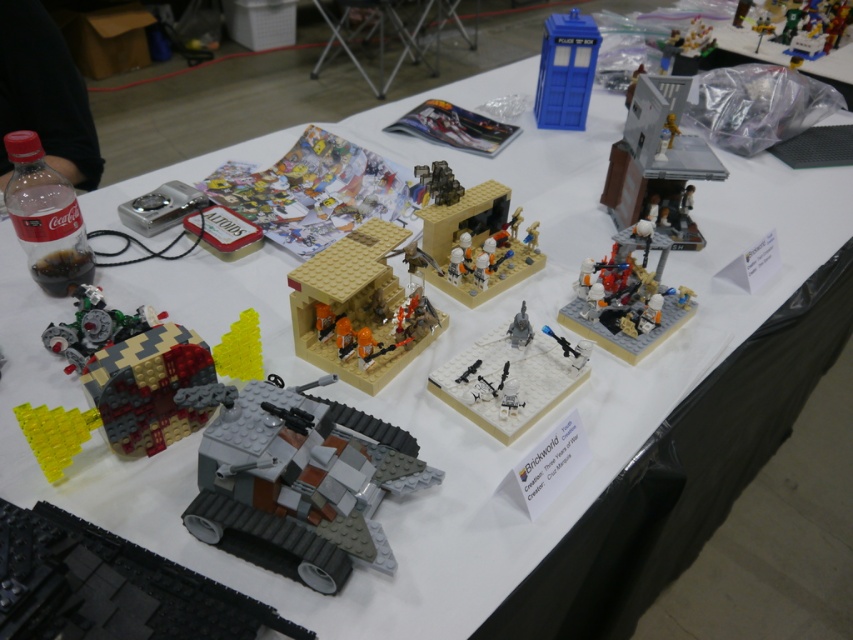
Question: Which object is positioned farthest from the white plastic tank at center?

Choices:
 (A) gray matte tank at lower left
 (B) translucent white plastic space station at center right

Answer: (A)

Question: Is shiny metallic gear at center further to camera compared to translucent plastic magazine at center?

Choices:
 (A) no
 (B) yes

Answer: (A)

Question: Which point is closer to the camera?

Choices:
 (A) cartoon paper at upper center
 (B) blue plastic tardis at upper right
 (C) gray matte tank at lower left
 (D) satin silver tank at center

Answer: (C)

Question: In this image, where is translucent plastic magazine at center located relative to yellow matte triangle at lower left?

Choices:
 (A) right
 (B) left

Answer: (A)

Question: Does yellow matte triangle at lower left lie behind satin silver tank at center?

Choices:
 (A) yes
 (B) no

Answer: (B)

Question: Which point is closer to the camera taking this photo?

Choices:
 (A) (165, 387)
 (B) (532, 369)

Answer: (A)